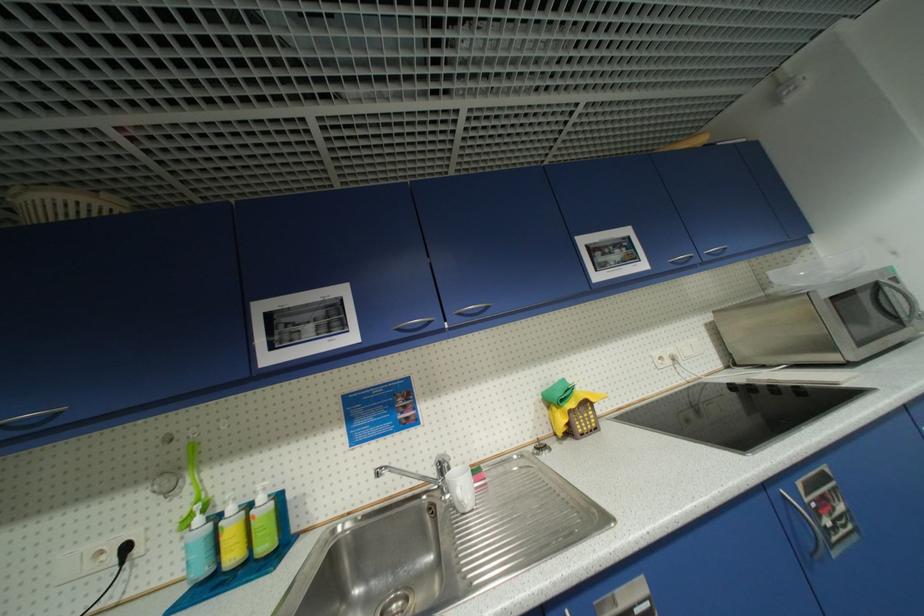
The width and height of the screenshot is (924, 616). I want to click on white mug handle, so click(458, 498).